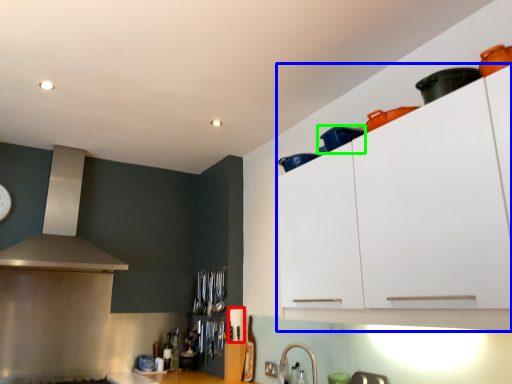
Question: Which is nearer to the appliance (highlighted by a red box)? cabinetry (highlighted by a blue box) or appliance (highlighted by a green box).

Choices:
 (A) cabinetry
 (B) appliance

Answer: (A)